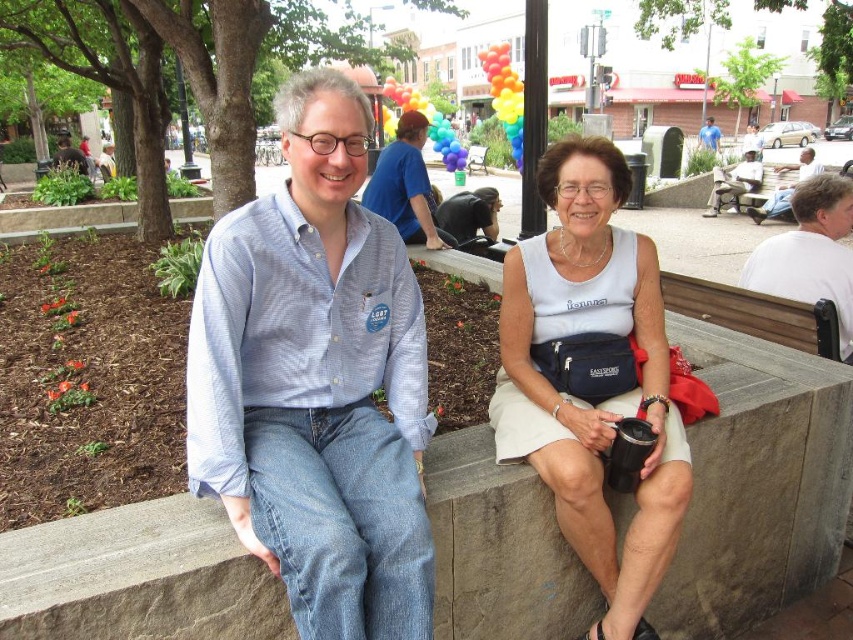
Question: Considering the relative positions of white fabric tank top at center and wooden bench at center in the image provided, where is white fabric tank top at center located with respect to wooden bench at center?

Choices:
 (A) above
 (B) below

Answer: (B)

Question: Which point appears closest to the camera in this image?

Choices:
 (A) (646, 404)
 (B) (480, 147)

Answer: (A)

Question: Can you confirm if white fabric tank top at center is smaller than wooden bench at center?

Choices:
 (A) no
 (B) yes

Answer: (B)

Question: Is white fabric tank top at center closer to camera compared to wooden bench at center?

Choices:
 (A) yes
 (B) no

Answer: (A)